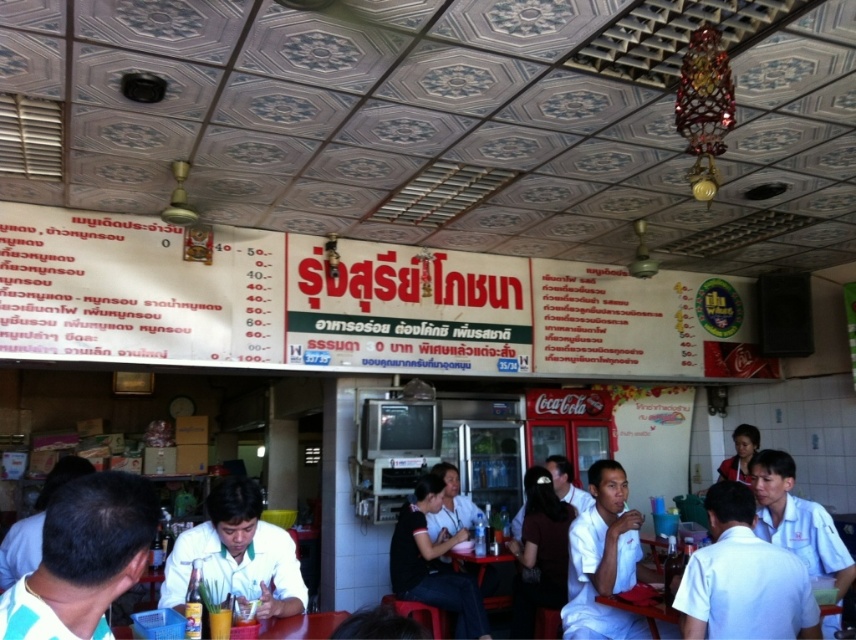
You are standing at point (473,595) in the restaurant. You need to walk to the entrance, which is 4.38 meters away. Is the entrance closer to the wall with the Thai menus or the wall with the Coca Cola advertisement?

The entrance is 4.38 meters away from point (473,595), but the question does not provide information about the location of the walls with Thai menus or the Coca Cola advertisement relative to the entrance. Therefore, it is impossible to determine which wall the entrance is closer to based on the given information.

You are a delivery person standing at the entrance of the restaurant. You need to place a package at point (82, 625). Can you reach that point without moving closer than 1 meter to the camera?

The distance of point (82, 625) from camera is 1.15 meters, so yes, you can reach that point without moving closer than 1 meter to the camera since it is farther away than 1 meter.